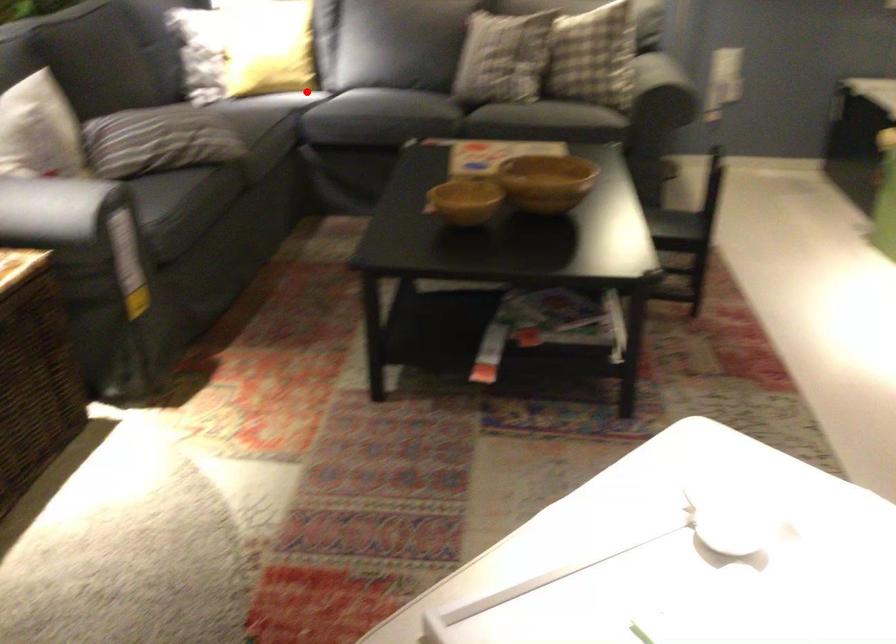
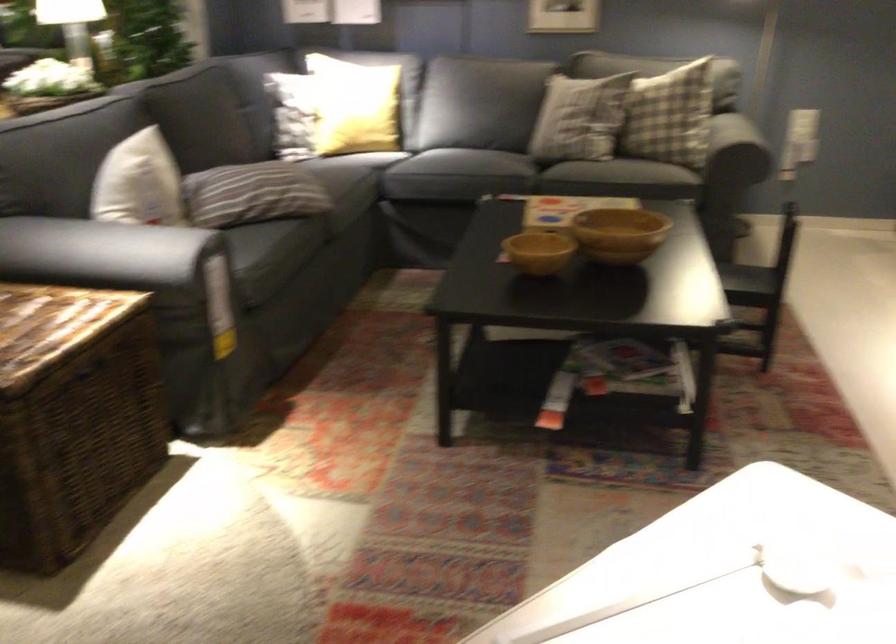
Question: I am providing you with two images of the same scene from different viewpoints. A red point is marked on the first image. Is the red point's position out of view in image 2?

Choices:
 (A) Yes
 (B) No

Answer: (B)